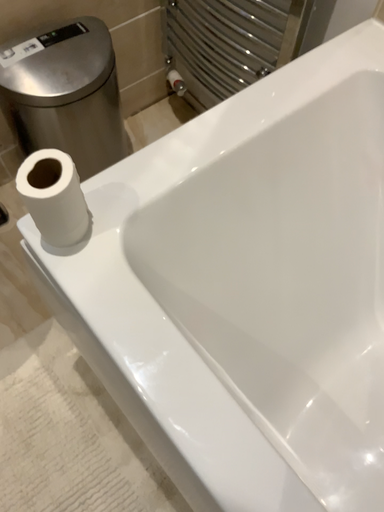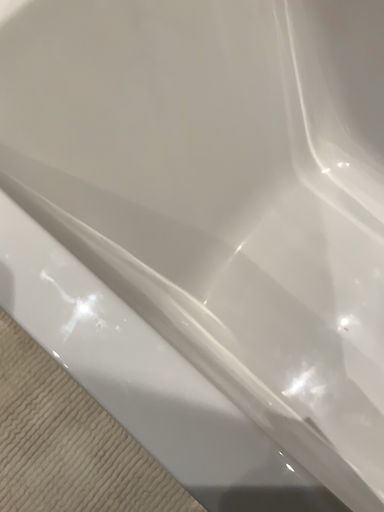
Question: How did the camera likely rotate when shooting the video?

Choices:
 (A) rotated downward
 (B) rotated upward

Answer: (A)